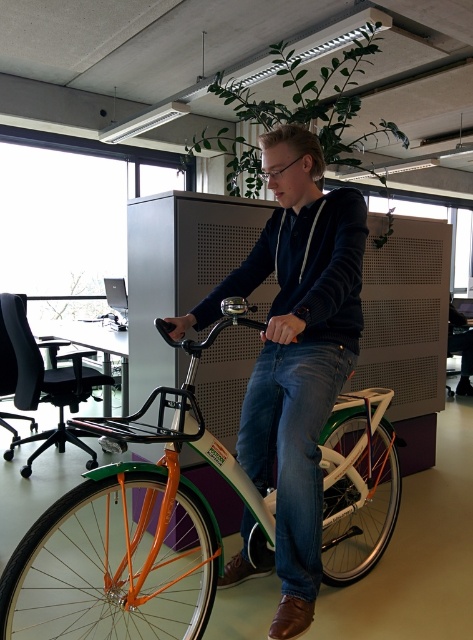
Question: Does orange matte bicycle at center have a smaller size compared to matte black hoodie at center?

Choices:
 (A) yes
 (B) no

Answer: (B)

Question: Among these points, which one is nearest to the camera?

Choices:
 (A) (304, 556)
 (B) (92, 628)

Answer: (A)

Question: Does orange matte bicycle at center have a larger size compared to matte black hoodie at center?

Choices:
 (A) no
 (B) yes

Answer: (B)

Question: Which point is farther from the camera taking this photo?

Choices:
 (A) (201, 301)
 (B) (26, 604)

Answer: (B)

Question: Where is orange matte bicycle at center located in relation to matte black hoodie at center in the image?

Choices:
 (A) above
 (B) below

Answer: (B)